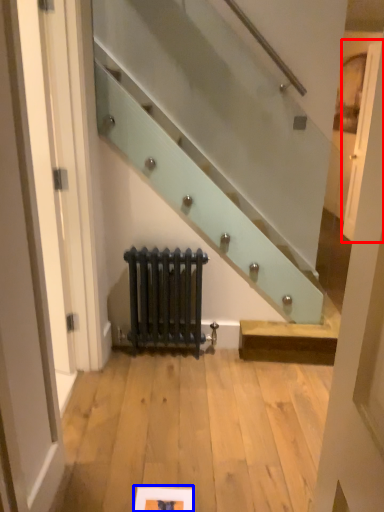
Question: Among these objects, which one is nearest to the camera, door (highlighted by a red box) or picture frame (highlighted by a blue box)?

Choices:
 (A) door
 (B) picture frame

Answer: (B)